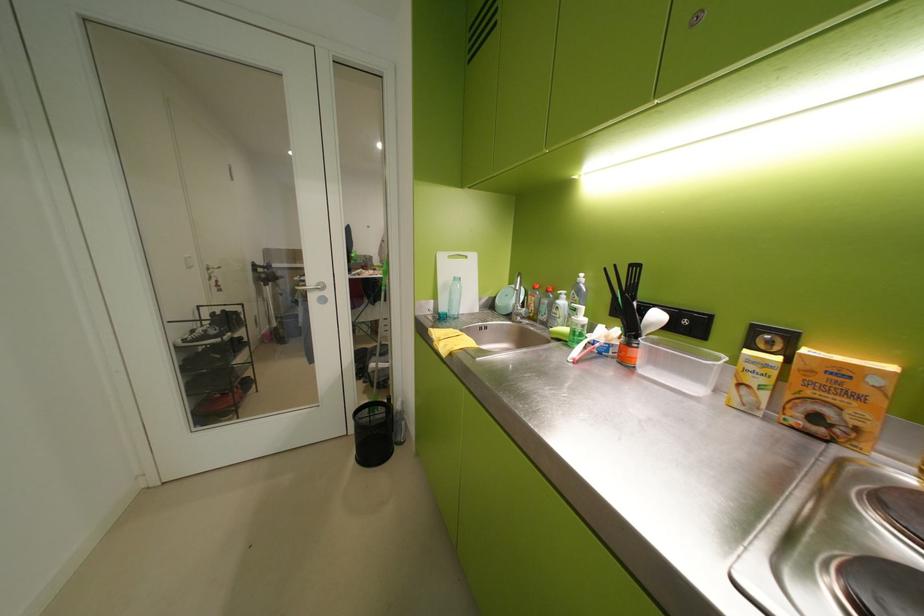
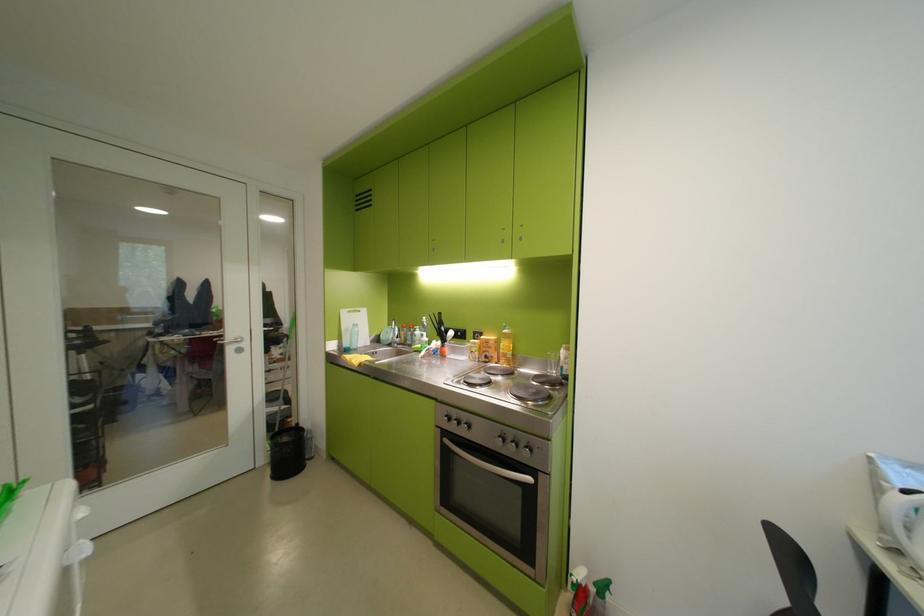
Find the pixel in the second image that matches point 453,310 in the first image.

(357, 345)